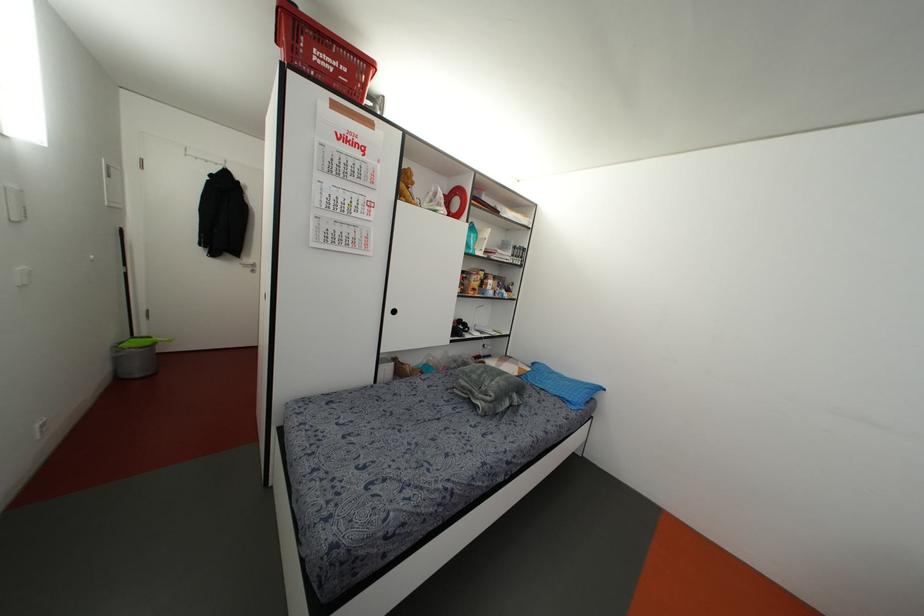
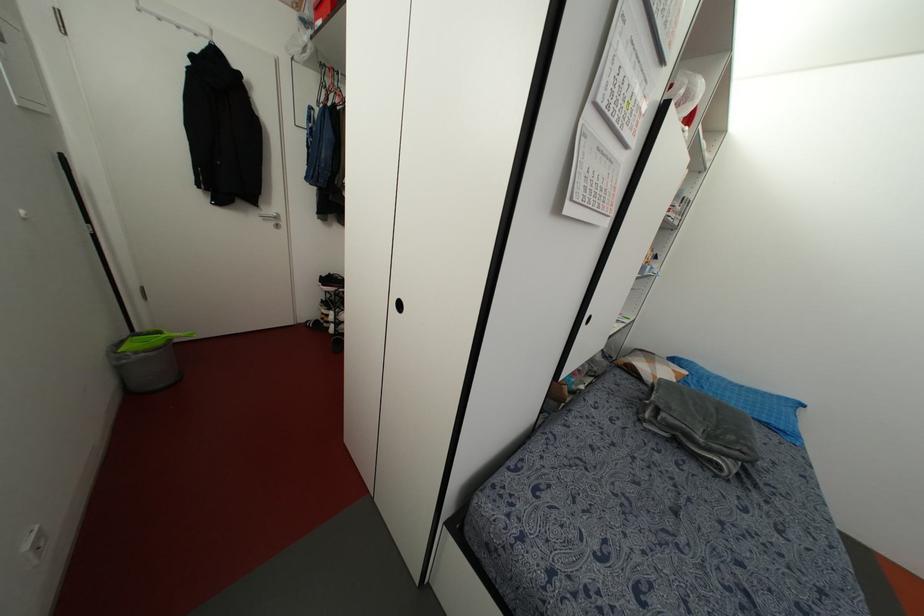
Where in the second image is the point corresponding to (569,399) from the first image?

(782, 427)